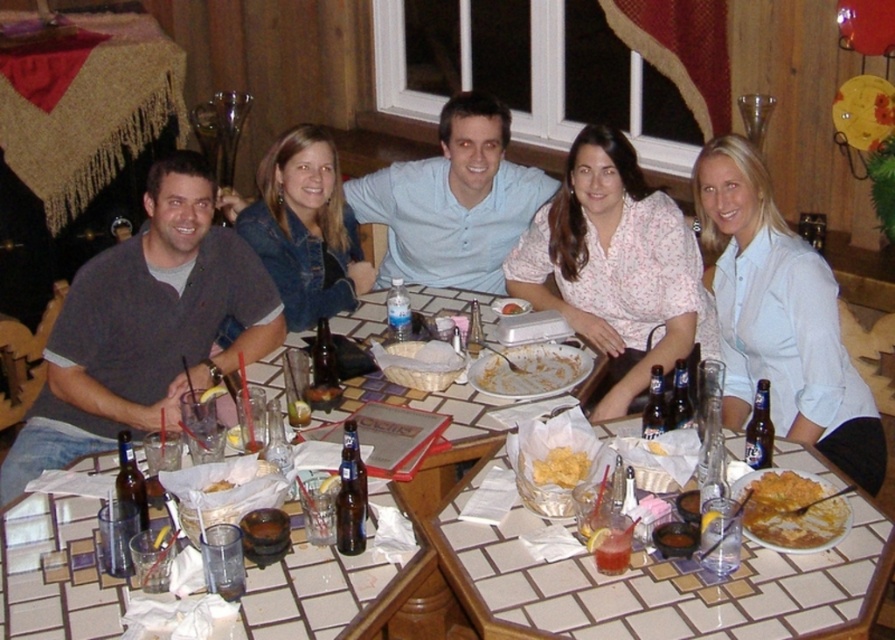
Question: Which of the following is the closest to the observer?

Choices:
 (A) (461, 390)
 (B) (548, 394)
 (C) (755, 449)

Answer: (C)

Question: Is white shirt at center positioned in front of blue glass bottle at table center?

Choices:
 (A) yes
 (B) no

Answer: (B)

Question: Can you confirm if clear glass water at center is smaller than yellow crispy chips at center?

Choices:
 (A) yes
 (B) no

Answer: (B)

Question: Which of these objects is positioned farthest from the white tile table at center?

Choices:
 (A) white ceramic plate at center
 (B) gray cotton shirt at left
 (C) yellow crispy chips at center

Answer: (B)

Question: Which object is the closest to the denim jacket at center?

Choices:
 (A) light blue button-down shirt at center
 (B) clear glass water at center
 (C) gray cotton shirt at left
 (D) white ceramic plate at center

Answer: (C)

Question: Does clear glass water at center come in front of white ceramic plate at center?

Choices:
 (A) no
 (B) yes

Answer: (B)